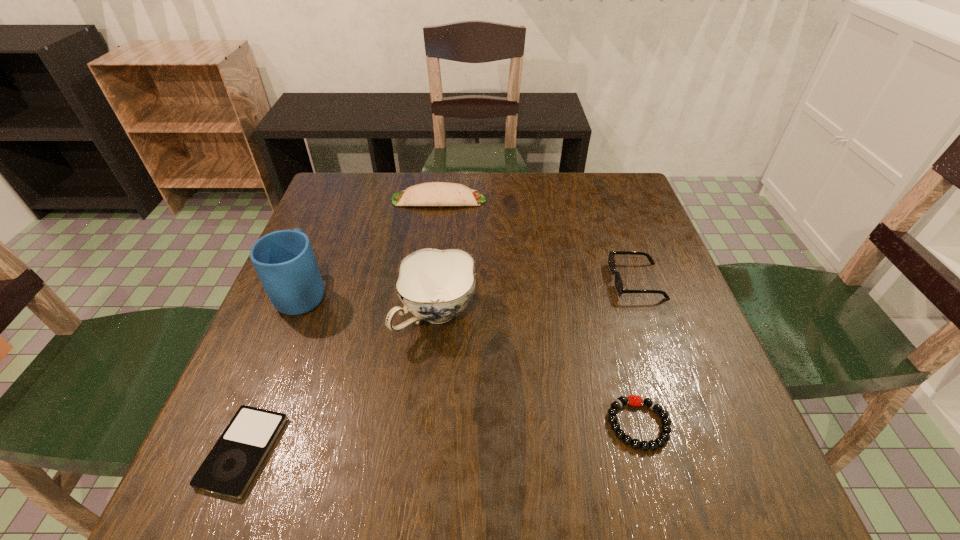
At what (x,y) coordinates should I click in order to perform the action: click on iPod located at the left edge. Please return your answer as a coordinate pair (x, y). This screenshot has width=960, height=540. Looking at the image, I should click on (232, 463).

Locate an element on the screen. This screenshot has height=540, width=960. sunglasses situated at the right edge is located at coordinates pyautogui.click(x=611, y=260).

Where is `bracelet present at the right edge`? This screenshot has width=960, height=540. bracelet present at the right edge is located at coordinates (664, 436).

Image resolution: width=960 pixels, height=540 pixels. What are the coordinates of `object positioned at the near left corner` in the screenshot? It's located at (232, 463).

You are a GUI agent. You are given a task and a screenshot of the screen. Output one action in this format:
    pyautogui.click(x=<x>, y=<y>)
    Task: Click on the object that is at the near right corner
    Image resolution: width=960 pixels, height=540 pixels.
    Given the screenshot: What is the action you would take?
    pyautogui.click(x=664, y=436)

The height and width of the screenshot is (540, 960). In order to click on vacant space at the far edge of the desktop in this screenshot , I will do `click(511, 174)`.

The height and width of the screenshot is (540, 960). In the image, there is a desktop. Find the location of `free space at the near edge`. free space at the near edge is located at coordinates [x=513, y=507].

You are a GUI agent. You are given a task and a screenshot of the screen. Output one action in this format:
    pyautogui.click(x=<x>, y=<y>)
    Task: Click on the vacant space at the left edge
    This screenshot has height=540, width=960.
    Given the screenshot: What is the action you would take?
    pyautogui.click(x=355, y=226)

This screenshot has width=960, height=540. I want to click on vacant space at the right edge of the desktop, so click(x=692, y=418).

I want to click on vacant space at the far left corner, so click(322, 208).